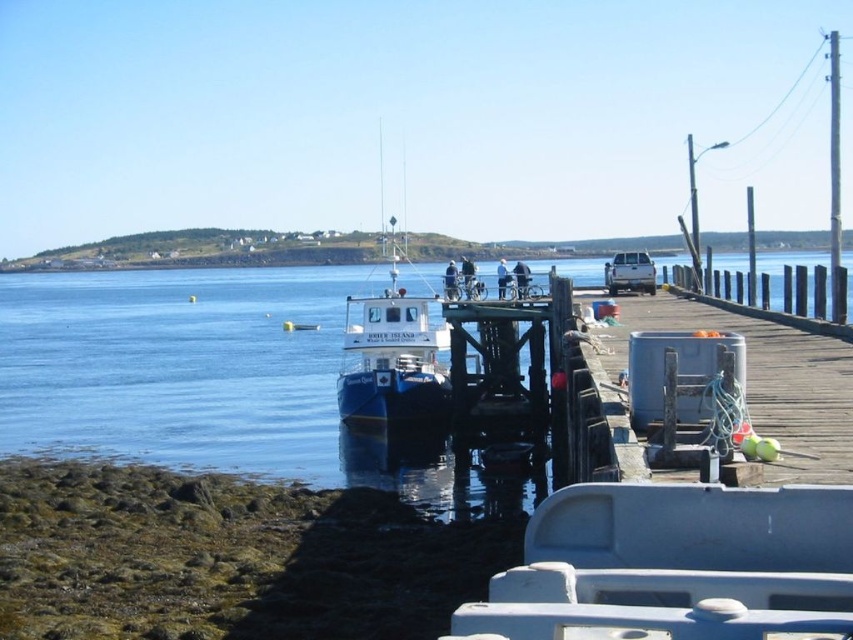
Is blue water at center closer to the viewer compared to blue matte boat at center?

Yes, blue water at center is in front of blue matte boat at center.

Which is in front, point (234, 321) or point (347, 380)?

Point (347, 380) is more forward.

Locate an element on the screen. The image size is (853, 640). blue water at center is located at coordinates [207, 378].

Is blue water at center in front of matte white truck at center?

That is True.

The width and height of the screenshot is (853, 640). In order to click on blue water at center in this screenshot , I will do `click(207, 378)`.

Image resolution: width=853 pixels, height=640 pixels. Find the location of `blue water at center`. blue water at center is located at coordinates (207, 378).

Can you confirm if white matte boat at center is positioned below matte white truck at center?

Yes, white matte boat at center is below matte white truck at center.

Who is more distant from viewer, (618, 586) or (631, 256)?

The point (631, 256) is behind.

Is point (848, 625) closer to camera compared to point (648, 259)?

Yes, point (848, 625) is in front of point (648, 259).

What are the coordinates of `white matte boat at center` in the screenshot? It's located at (676, 564).